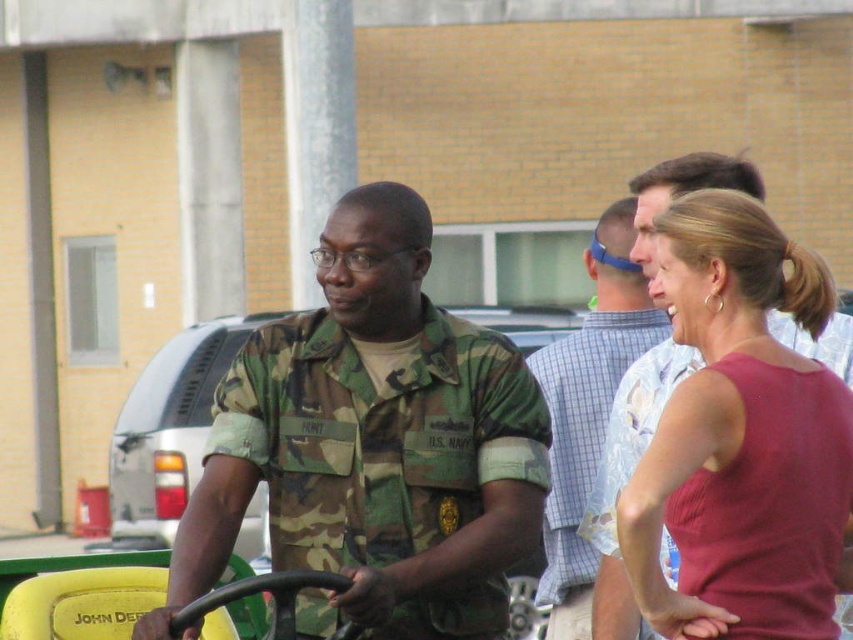
Does camo uniform at center have a smaller size compared to blue plaid shirt at center?

No.

Does camo uniform at center lie in front of blue plaid shirt at center?

That is True.

Measure the distance between camo uniform at center and camera.

camo uniform at center and camera are 26.65 feet apart from each other.

Locate an element on the screen. camo uniform at center is located at coordinates (373, 444).

Which of these two, camo uniform at center or matte red tank top at center right, stands taller?

camo uniform at center is taller.

Can you confirm if camo uniform at center is positioned above matte red tank top at center right?

Actually, camo uniform at center is below matte red tank top at center right.

Is point (291, 518) closer to viewer compared to point (659, 582)?

No, it is not.

Where is `camo uniform at center`? camo uniform at center is located at coordinates (373, 444).

Can you confirm if matte red tank top at center right is positioned to the right of blue plaid shirt at center?

Indeed, matte red tank top at center right is positioned on the right side of blue plaid shirt at center.

Can you confirm if matte red tank top at center right is smaller than blue plaid shirt at center?

Actually, matte red tank top at center right might be larger than blue plaid shirt at center.

The image size is (853, 640). What do you see at coordinates (730, 410) in the screenshot? I see `matte red tank top at center right` at bounding box center [730, 410].

Identify the location of matte red tank top at center right. The width and height of the screenshot is (853, 640). (730, 410).